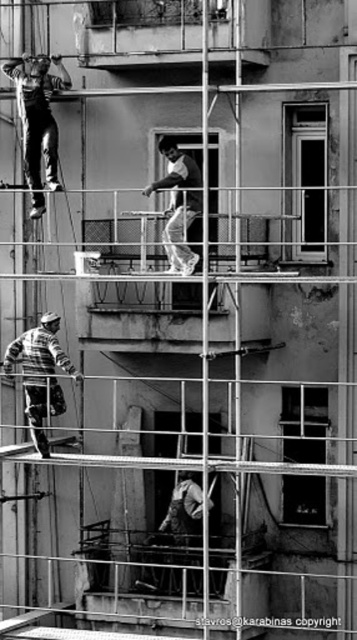
Between striped sweater at lower left and smooth white shirt at center, which one is positioned lower?

Positioned lower is striped sweater at lower left.

Consider the image. Which is more to the right, striped sweater at lower left or smooth white shirt at center?

smooth white shirt at center is more to the right.

Does point (31, 392) lie in front of point (171, 268)?

No, it is behind (171, 268).

At what (x,y) coordinates should I click in order to perform the action: click on striped sweater at lower left. Please return your answer as a coordinate pair (x, y). Looking at the image, I should click on (41, 374).

Which is below, shiny black overalls at upper left or striped sweater at lower left?

striped sweater at lower left is below.

Which is in front, point (24, 141) or point (37, 332)?

Point (37, 332) is in front.

In order to click on shiny black overalls at upper left in this screenshot , I will do `click(37, 120)`.

Does shiny black overalls at upper left appear over smooth white shirt at center?

Correct, shiny black overalls at upper left is located above smooth white shirt at center.

Is shiny black overalls at upper left positioned before smooth white shirt at center?

That is False.

Who is more forward, [19,84] or [172,166]?

Positioned in front is point [172,166].

The height and width of the screenshot is (640, 357). Find the location of `shiny black overalls at upper left`. shiny black overalls at upper left is located at coordinates (37, 120).